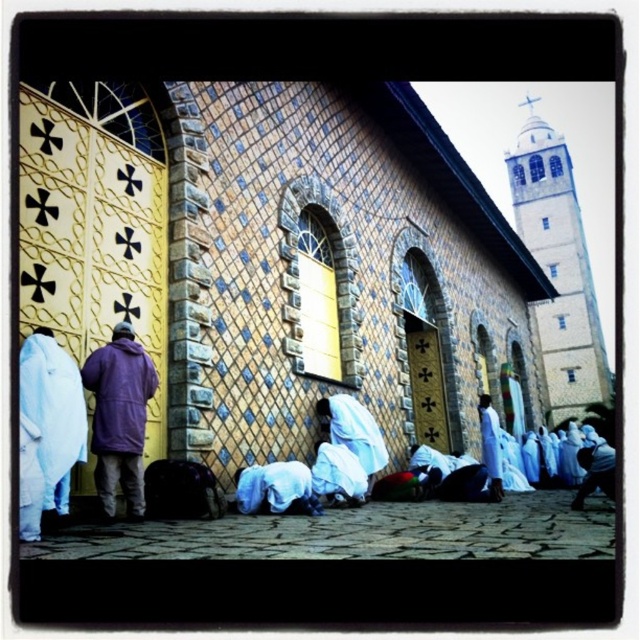
You are a photographer standing at the entrance of the church. You want to take a picture that includes both the purple fleece jacket at left and the white cotton robe at center. What is the minimum distance you need to move backward to ensure both subjects are in frame?

The purple fleece jacket at left is 54.40 feet from the white cotton robe at center. To include both in the frame, you need to move back at least half of that distance, which is approximately 27.20 feet, to ensure both are visible.